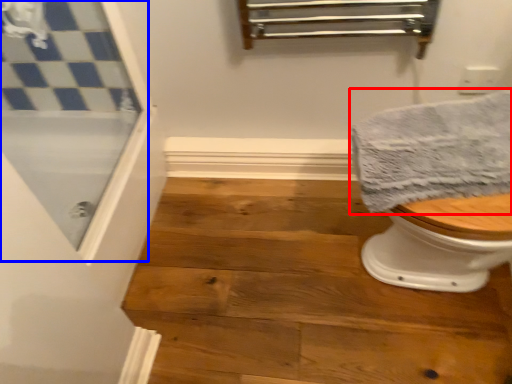
Question: Which object appears farthest to the camera in this image, towel (highlighted by a red box) or screen door (highlighted by a blue box)?

Choices:
 (A) towel
 (B) screen door

Answer: (A)